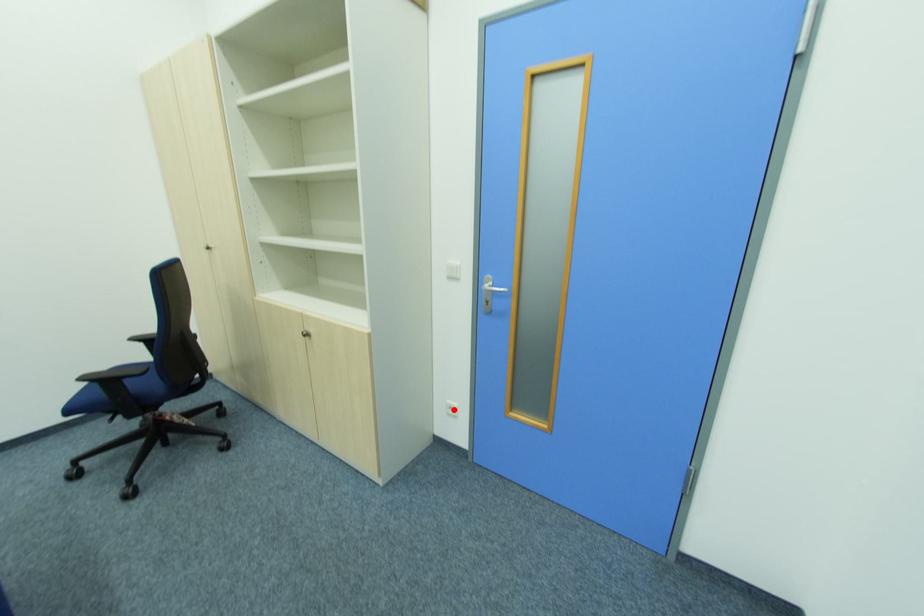
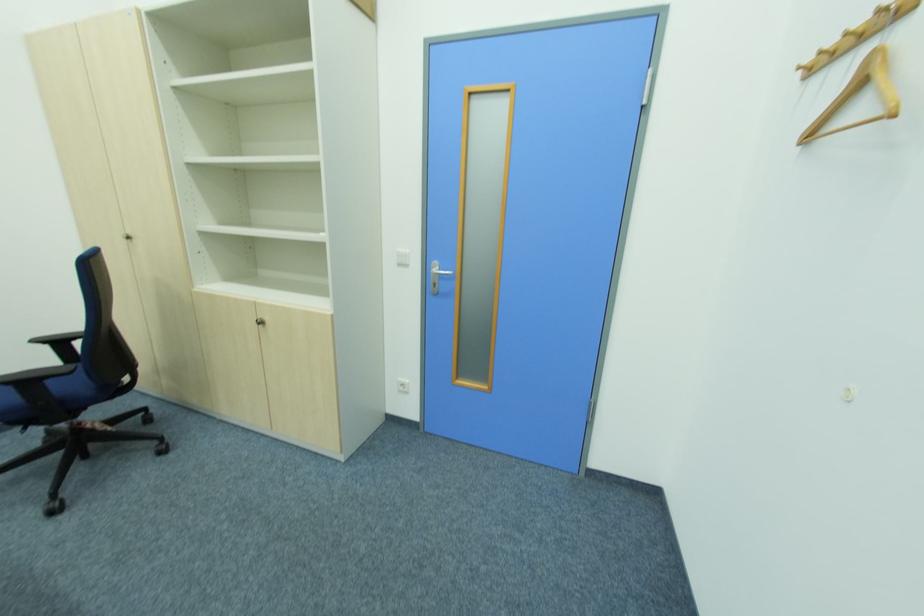
Question: I am providing you with two images of the same scene from different viewpoints. A red point is marked on the first image. At the location where the point appears in image 1, is it still visible in image 2?

Choices:
 (A) Yes
 (B) No

Answer: (A)